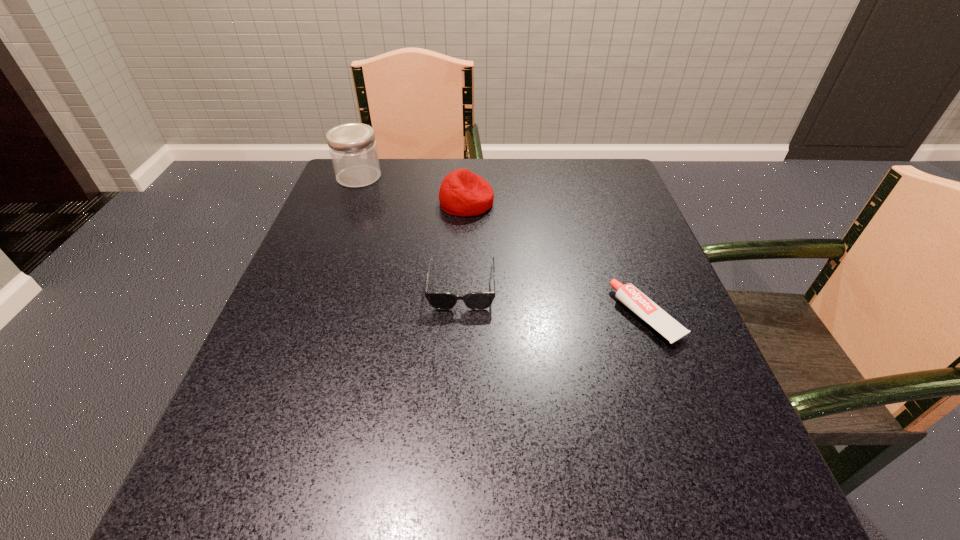
At what (x,y) coordinates should I click in order to perform the action: click on jar present at the far edge. Please return your answer as a coordinate pair (x, y). The width and height of the screenshot is (960, 540). Looking at the image, I should click on (352, 146).

Find the location of a particular element. beanbag located in the far edge section of the desktop is located at coordinates (x=462, y=193).

At what (x,y) coordinates should I click in order to perform the action: click on object that is positioned at the left edge. Please return your answer as a coordinate pair (x, y). The width and height of the screenshot is (960, 540). Looking at the image, I should click on (352, 146).

Where is `object situated at the right edge`? The image size is (960, 540). object situated at the right edge is located at coordinates (628, 294).

Find the location of a particular element. object that is at the far left corner is located at coordinates (352, 146).

At what (x,y) coordinates should I click in order to perform the action: click on free spot at the far edge of the desktop. Please return your answer as a coordinate pair (x, y). The height and width of the screenshot is (540, 960). Looking at the image, I should click on (418, 207).

Image resolution: width=960 pixels, height=540 pixels. Find the location of `vacant space at the near edge of the desktop`. vacant space at the near edge of the desktop is located at coordinates (618, 539).

This screenshot has height=540, width=960. I want to click on vacant space at the left edge of the desktop, so click(x=337, y=335).

Find the location of a particular element. vacant space at the right edge is located at coordinates (588, 276).

In the image, there is a desktop. Where is `vacant space at the far left corner`? Image resolution: width=960 pixels, height=540 pixels. vacant space at the far left corner is located at coordinates coord(399,161).